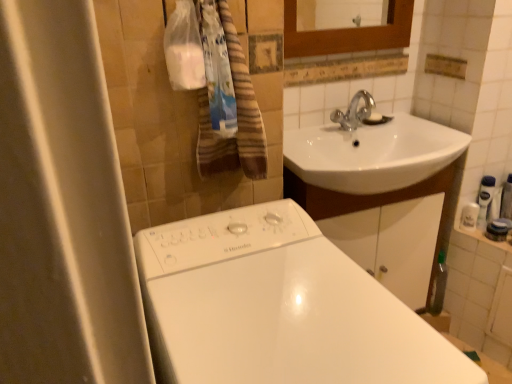
What is the approximate height of brown striped towel at upper left?

The height of brown striped towel at upper left is 18.40 inches.

Identify the location of white plastic soap dispenser at right, which is the 2th toiletry from right to left. [x=469, y=216].

This screenshot has height=384, width=512. What do you see at coordinates (469, 216) in the screenshot? I see `white plastic soap dispenser at right, acting as the first toiletry starting from the left` at bounding box center [469, 216].

The width and height of the screenshot is (512, 384). Find the location of `white glossy bathtub at lower center`. white glossy bathtub at lower center is located at coordinates pyautogui.click(x=278, y=307).

Based on the photo, in order to face white glossy lotion at right, the first toiletry viewed from the right, should I rotate leftwards or rightwards?

Rotate right and turn 28.160 degrees.

At what (x,y) coordinates should I click in order to perform the action: click on brown striped towel at upper left. Please return your answer as a coordinate pair (x, y). Looking at the image, I should click on (237, 118).

Is brown striped towel at upper left touching white glossy lotion at right, placed as the 2th toiletry when sorted from left to right?

No, brown striped towel at upper left is not in contact with white glossy lotion at right, placed as the 2th toiletry when sorted from left to right.

Image resolution: width=512 pixels, height=384 pixels. Find the location of `the 2nd toiletry to the right of the brown striped towel at upper left, counting from the anchor's position`. the 2nd toiletry to the right of the brown striped towel at upper left, counting from the anchor's position is located at coordinates (485, 200).

Does point (237, 102) appear closer or farther from the camera than point (488, 177)?

Point (237, 102) is closer to the camera than point (488, 177).

From a real-world perspective, is brown striped towel at upper left positioned above or below white glossy lotion at right, placed as the 2th toiletry when sorted from left to right?

brown striped towel at upper left is situated higher than white glossy lotion at right, placed as the 2th toiletry when sorted from left to right, in the real world.

Looking at the image, does white plastic soap dispenser at right, which is the 2th toiletry from right to left, seem bigger or smaller compared to white glossy lotion at right, placed as the 2th toiletry when sorted from left to right?

Considering their sizes, white plastic soap dispenser at right, which is the 2th toiletry from right to left, takes up less space than white glossy lotion at right, placed as the 2th toiletry when sorted from left to right.

Based on the photo, from a real-world perspective, is white plastic soap dispenser at right, which is the 2th toiletry from right to left, on top of white glossy lotion at right, placed as the 2th toiletry when sorted from left to right?

No.

Can you tell me how much white plastic soap dispenser at right, acting as the first toiletry starting from the left, and white glossy lotion at right, placed as the 2th toiletry when sorted from left to right, differ in facing direction?

white plastic soap dispenser at right, acting as the first toiletry starting from the left, and white glossy lotion at right, placed as the 2th toiletry when sorted from left to right, are facing 0.000767 degrees away from each other.

Is white plastic soap dispenser at right, acting as the first toiletry starting from the left, not close to white glossy lotion at right, the first toiletry viewed from the right?

That's not correct — white plastic soap dispenser at right, acting as the first toiletry starting from the left, is a little close to white glossy lotion at right, the first toiletry viewed from the right.

Is the depth of brown striped towel at upper left less than that of white glossy bathtub at lower center?

No, brown striped towel at upper left is further to the viewer.

Does point (238, 136) come closer to viewer compared to point (474, 380)?

No, (238, 136) is behind (474, 380).

Locate an element on the screen. The height and width of the screenshot is (384, 512). bath towel above the white glossy lotion at right, the first toiletry viewed from the right (from a real-world perspective) is located at coordinates (237, 118).

Is white glossy lotion at right, the first toiletry viewed from the right, facing away from brown striped towel at upper left?

No.

Between white glossy lotion at right, the first toiletry viewed from the right, and brown striped towel at upper left, which one is positioned in front?

brown striped towel at upper left is closer to the camera.

What's the angular difference between white glossy lotion at right, the first toiletry viewed from the right, and brown striped towel at upper left's facing directions?

0.00178 degrees.

Is there a large distance between white glossy bathtub at lower center and brown striped towel at upper left?

No, there isn't a large distance between white glossy bathtub at lower center and brown striped towel at upper left.

Which is behind, point (264, 215) or point (208, 144)?

The point (208, 144) is farther.

What's the angular difference between white glossy bathtub at lower center and brown striped towel at upper left's facing directions?

The facing directions of white glossy bathtub at lower center and brown striped towel at upper left are 0.000248 degrees apart.

Which of these two, white glossy lotion at right, the first toiletry viewed from the right, or white plastic soap dispenser at right, acting as the first toiletry starting from the left, is smaller?

white plastic soap dispenser at right, acting as the first toiletry starting from the left.

Considering the positions of objects white glossy lotion at right, placed as the 2th toiletry when sorted from left to right, and white plastic soap dispenser at right, which is the 2th toiletry from right to left, in the image provided, who is more to the right, white glossy lotion at right, placed as the 2th toiletry when sorted from left to right, or white plastic soap dispenser at right, which is the 2th toiletry from right to left,?

white glossy lotion at right, placed as the 2th toiletry when sorted from left to right, is more to the right.

Is white glossy lotion at right, the first toiletry viewed from the right, not close to white plastic soap dispenser at right, acting as the first toiletry starting from the left?

No, white glossy lotion at right, the first toiletry viewed from the right, is not far away from white plastic soap dispenser at right, acting as the first toiletry starting from the left.

In the scene shown: Is white glossy lotion at right, placed as the 2th toiletry when sorted from left to right, looking in the opposite direction of white plastic soap dispenser at right, which is the 2th toiletry from right to left?

No.

Is white glossy bathtub at lower center next to white glossy lotion at right, placed as the 2th toiletry when sorted from left to right?

No, white glossy bathtub at lower center is not making contact with white glossy lotion at right, placed as the 2th toiletry when sorted from left to right.

What's the angular difference between white glossy bathtub at lower center and white glossy lotion at right, placed as the 2th toiletry when sorted from left to right,'s facing directions?

The facing directions of white glossy bathtub at lower center and white glossy lotion at right, placed as the 2th toiletry when sorted from left to right, are 0.00154 degrees apart.

Which object is thinner, white glossy bathtub at lower center or white glossy lotion at right, the first toiletry viewed from the right?

Thinner between the two is white glossy lotion at right, the first toiletry viewed from the right.

Where is `bath towel lying in front of the white glossy lotion at right, the first toiletry viewed from the right`? This screenshot has height=384, width=512. bath towel lying in front of the white glossy lotion at right, the first toiletry viewed from the right is located at coordinates (237, 118).

Locate an element on the screen. The image size is (512, 384). toiletry on the right of white plastic soap dispenser at right, acting as the first toiletry starting from the left is located at coordinates (485, 200).

When comparing their distances from white glossy lotion at right, the first toiletry viewed from the right, does white plastic soap dispenser at right, acting as the first toiletry starting from the left, or white glossy bathtub at lower center seem closer?

The object closer to white glossy lotion at right, the first toiletry viewed from the right, is white plastic soap dispenser at right, acting as the first toiletry starting from the left.

Consider the image. When comparing their distances from brown striped towel at upper left, does white glossy bathtub at lower center or white plastic soap dispenser at right, which is the 2th toiletry from right to left, seem further?

The object further to brown striped towel at upper left is white plastic soap dispenser at right, which is the 2th toiletry from right to left.

Considering their positions, is white glossy bathtub at lower center positioned further to white glossy lotion at right, placed as the 2th toiletry when sorted from left to right, than white plastic soap dispenser at right, which is the 2th toiletry from right to left?

white glossy bathtub at lower center.

Considering their positions, is brown striped towel at upper left positioned closer to white plastic soap dispenser at right, acting as the first toiletry starting from the left, than white glossy bathtub at lower center?

Based on the image, brown striped towel at upper left appears to be nearer to white plastic soap dispenser at right, acting as the first toiletry starting from the left.

Considering their positions, is white glossy lotion at right, the first toiletry viewed from the right, positioned further to white glossy bathtub at lower center than white plastic soap dispenser at right, acting as the first toiletry starting from the left?

Among the two, white glossy lotion at right, the first toiletry viewed from the right, is located further to white glossy bathtub at lower center.

Estimate the real-world distances between objects in this image. Which object is further from white glossy bathtub at lower center, brown striped towel at upper left or white plastic soap dispenser at right, which is the 2th toiletry from right to left?

Among the two, white plastic soap dispenser at right, which is the 2th toiletry from right to left, is located further to white glossy bathtub at lower center.

In the scene shown: When comparing their distances from white plastic soap dispenser at right, which is the 2th toiletry from right to left, does brown striped towel at upper left or white glossy lotion at right, the first toiletry viewed from the right, seem closer?

white glossy lotion at right, the first toiletry viewed from the right, is closer to white plastic soap dispenser at right, which is the 2th toiletry from right to left.

Consider the image. Estimate the real-world distances between objects in this image. Which object is further from white glossy lotion at right, placed as the 2th toiletry when sorted from left to right, brown striped towel at upper left or white glossy bathtub at lower center?

white glossy bathtub at lower center.

Where is `toiletry between white glossy bathtub at lower center and white plastic soap dispenser at right, acting as the first toiletry starting from the left, from front to back`? toiletry between white glossy bathtub at lower center and white plastic soap dispenser at right, acting as the first toiletry starting from the left, from front to back is located at coordinates (485, 200).

Identify the location of bath towel between white glossy bathtub at lower center and white glossy lotion at right, placed as the 2th toiletry when sorted from left to right, from front to back. The height and width of the screenshot is (384, 512). (237, 118).

You are a GUI agent. You are given a task and a screenshot of the screen. Output one action in this format:
    pyautogui.click(x=<x>, y=<y>)
    Task: Click on the toiletry between brown striped towel at upper left and white glossy lotion at right, the first toiletry viewed from the right
    This screenshot has width=512, height=384.
    Given the screenshot: What is the action you would take?
    pyautogui.click(x=469, y=216)

You are a GUI agent. You are given a task and a screenshot of the screen. Output one action in this format:
    pyautogui.click(x=<x>, y=<y>)
    Task: Click on the bath towel between white glossy bathtub at lower center and white plastic soap dispenser at right, which is the 2th toiletry from right to left, along the z-axis
    This screenshot has height=384, width=512.
    Given the screenshot: What is the action you would take?
    pyautogui.click(x=237, y=118)